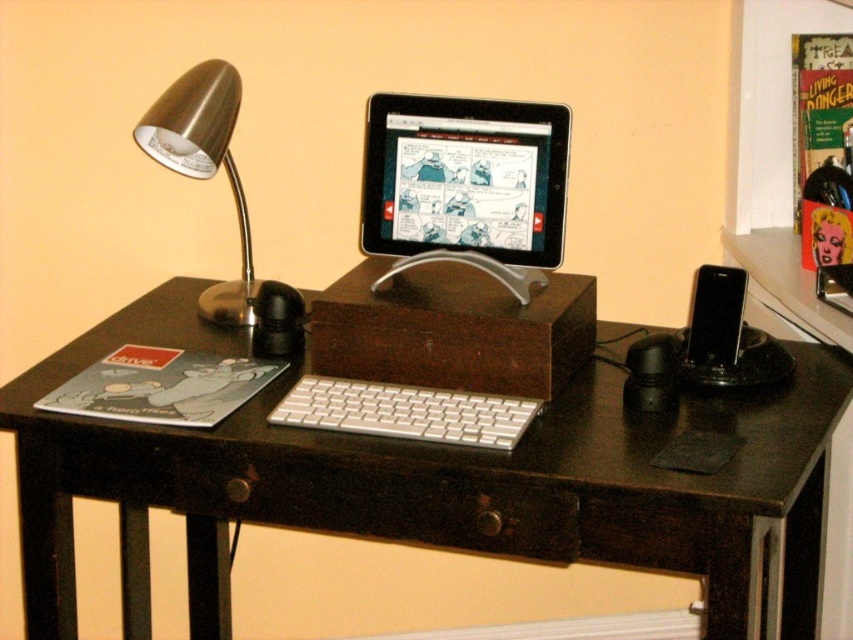
Question: Is white plastic keyboard at center above brushed metal desk lamp at left?

Choices:
 (A) no
 (B) yes

Answer: (A)

Question: Which point is closer to the camera?

Choices:
 (A) (235, 184)
 (B) (358, 499)

Answer: (B)

Question: Is white plastic keyboard at center thinner than white aluminum keyboard at center?

Choices:
 (A) no
 (B) yes

Answer: (A)

Question: Which point is farther to the camera?

Choices:
 (A) white plastic keyboard at center
 (B) silver metallic tablet at center
 (C) white aluminum keyboard at center

Answer: (B)

Question: Can you confirm if silver metallic tablet at center is wider than black wood drawer at center?

Choices:
 (A) yes
 (B) no

Answer: (B)

Question: Which of the following is the closest to the observer?

Choices:
 (A) brushed metal desk lamp at left
 (B) white plastic keyboard at center
 (C) black wood drawer at center
 (D) white aluminum keyboard at center

Answer: (B)